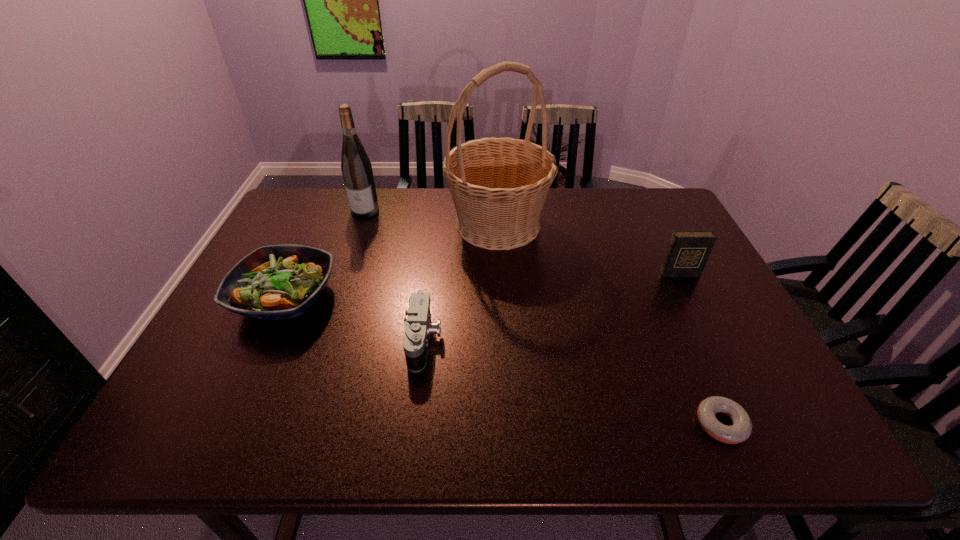
Locate an element on the screen. This screenshot has height=540, width=960. free space located 0.270m on the right of the salad plate is located at coordinates (441, 298).

Identify the location of free space located 0.290m on the lens of the camera. (564, 341).

Find the location of a particular element. vacant space located on the left of the shortest object is located at coordinates [519, 424].

Find the location of a particular element. This screenshot has width=960, height=540. basket present at the far edge is located at coordinates (499, 185).

Where is `wine bottle that is at the far edge`? This screenshot has width=960, height=540. wine bottle that is at the far edge is located at coordinates (356, 167).

The height and width of the screenshot is (540, 960). Identify the location of object positioned at the near edge. (740, 431).

Find the location of `object present at the left edge`. object present at the left edge is located at coordinates click(274, 282).

What are the coordinates of `diary at the right edge` in the screenshot? It's located at (688, 251).

Locate an element on the screen. The width and height of the screenshot is (960, 540). doughnut at the right edge is located at coordinates (740, 431).

Where is `object at the near right corner`? Image resolution: width=960 pixels, height=540 pixels. object at the near right corner is located at coordinates (740, 431).